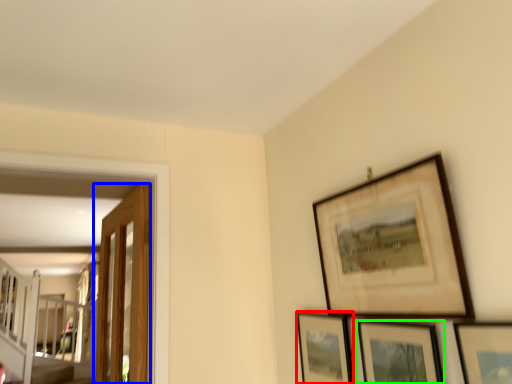
Question: Estimate the real-world distances between objects in this image. Which object is closer to picture frame (highlighted by a red box), door (highlighted by a blue box) or picture frame (highlighted by a green box)?

Choices:
 (A) door
 (B) picture frame

Answer: (B)